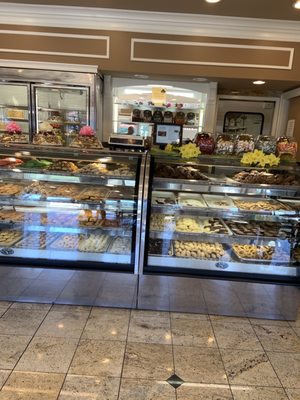
The image size is (300, 400). I want to click on window, so click(x=249, y=123).